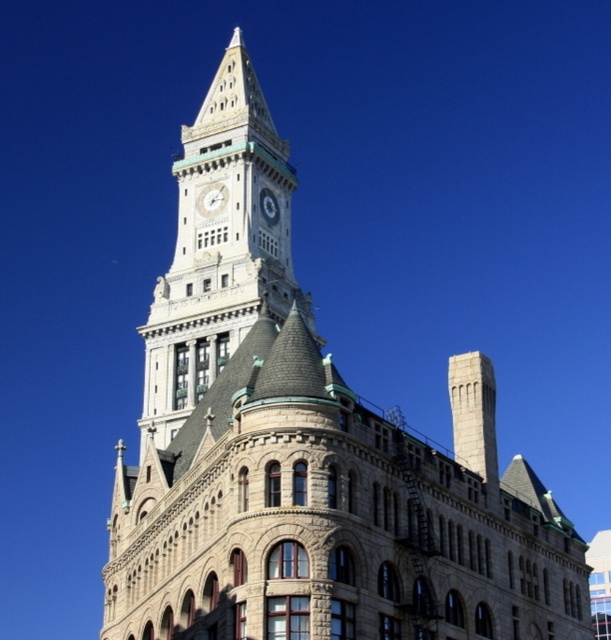
Question: Observing the image, what is the correct spatial positioning of white glossy clock at upper center in reference to silver metallic clock at center?

Choices:
 (A) below
 (B) above

Answer: (B)

Question: Can you confirm if stone clock tower at center is positioned to the left of silver metallic clock at center?

Choices:
 (A) yes
 (B) no

Answer: (A)

Question: Among these objects, which one is farthest from the camera?

Choices:
 (A) stone clock tower at center
 (B) white glossy clock at upper center

Answer: (B)

Question: Is stone clock tower at center to the right of white glossy clock at upper center from the viewer's perspective?

Choices:
 (A) yes
 (B) no

Answer: (B)

Question: Estimate the real-world distances between objects in this image. Which object is farther from the stone clock tower at center?

Choices:
 (A) white glossy clock at upper center
 (B) silver metallic clock at center

Answer: (B)

Question: Which object is closer to the camera taking this photo?

Choices:
 (A) white glossy clock at upper center
 (B) stone clock tower at center
 (C) silver metallic clock at center

Answer: (B)